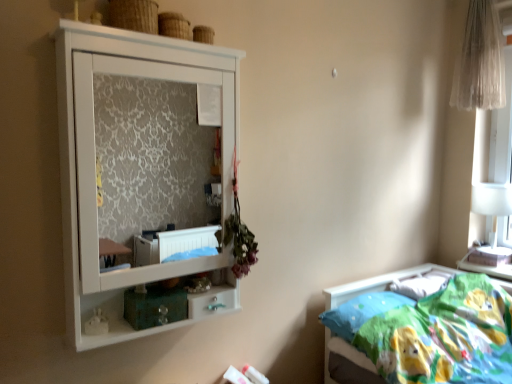
What do you see at coordinates (212, 302) in the screenshot? I see `white glossy drawer at lower center` at bounding box center [212, 302].

What do you see at coordinates (492, 202) in the screenshot? I see `white glossy table lamp at right` at bounding box center [492, 202].

This screenshot has height=384, width=512. I want to click on white glossy drawer at lower center, so click(x=212, y=302).

Does soft cotton bed at lower right appear on the right side of white matte cupboard at upper left?

Indeed, soft cotton bed at lower right is positioned on the right side of white matte cupboard at upper left.

Which object is closer to the camera taking this photo, soft cotton bed at lower right or white matte cupboard at upper left?

white matte cupboard at upper left is more forward.

Can white matte cupboard at upper left be found inside soft cotton bed at lower right?

No, soft cotton bed at lower right does not contain white matte cupboard at upper left.

Considering the relative sizes of blue fabric pillow at lower right and soft cotton bed at lower right in the image provided, is blue fabric pillow at lower right smaller than soft cotton bed at lower right?

Correct, blue fabric pillow at lower right occupies less space than soft cotton bed at lower right.

From a real-world perspective, which is physically below, blue fabric pillow at lower right or soft cotton bed at lower right?

From a 3D spatial view, soft cotton bed at lower right is below.

Measure the distance between blue fabric pillow at lower right and soft cotton bed at lower right.

blue fabric pillow at lower right is 5.09 inches from soft cotton bed at lower right.

Are blue fabric pillow at lower right and soft cotton bed at lower right making contact?

blue fabric pillow at lower right is not next to soft cotton bed at lower right, and they're not touching.

Is white glossy table lamp at right aimed at sheer white curtain at upper right?

No, white glossy table lamp at right is not oriented towards sheer white curtain at upper right.

Considering the relative positions of white glossy table lamp at right and sheer white curtain at upper right in the image provided, is white glossy table lamp at right behind sheer white curtain at upper right?

Yes, white glossy table lamp at right is further from the camera.

Based on their positions, is white glossy table lamp at right located to the left or right of sheer white curtain at upper right?

white glossy table lamp at right is to the right of sheer white curtain at upper right.

Is point (471, 203) less distant than point (475, 64)?

No, it is not.

Is the position of wooden textured basket at upper center more distant than that of white glossy drawer at lower center?

That is False.

Is wooden textured basket at upper center bigger than white glossy drawer at lower center?

Yes.

Is point (135, 4) closer or farther from the camera than point (221, 300)?

Point (135, 4) appears to be farther away from the viewer than point (221, 300).

How much distance is there between wooden textured basket at upper center and white glossy drawer at lower center?

A distance of 1.17 meters exists between wooden textured basket at upper center and white glossy drawer at lower center.

Is wooden textured basket at upper center to the right of blue fabric pillow at lower right from the viewer's perspective?

No.

Is wooden textured basket at upper center spatially inside blue fabric pillow at lower right, or outside of it?

The correct answer is: outside.

Is the depth of wooden textured basket at upper center greater than that of blue fabric pillow at lower right?

That is False.

From the image's perspective, who appears lower, wooden textured basket at upper center or blue fabric pillow at lower right?

From the image's view, blue fabric pillow at lower right is below.

From a real-world perspective, which object rests below the other?

From a 3D spatial view, blue fabric pillow at lower right is below.

Considering the sizes of objects blue fabric pillow at lower right and white matte cupboard at upper left in the image provided, who is shorter, blue fabric pillow at lower right or white matte cupboard at upper left?

With less height is blue fabric pillow at lower right.

Which of these two, blue fabric pillow at lower right or white matte cupboard at upper left, is bigger?

white matte cupboard at upper left is bigger.

Is blue fabric pillow at lower right surrounded by white glossy table lamp at right?

Actually, blue fabric pillow at lower right is outside white glossy table lamp at right.

Where is `table lamp behind the blue fabric pillow at lower right`? Image resolution: width=512 pixels, height=384 pixels. table lamp behind the blue fabric pillow at lower right is located at coordinates (492, 202).

From the image's perspective, which one is positioned lower, white glossy table lamp at right or blue fabric pillow at lower right?

blue fabric pillow at lower right appears lower in the image.

Between white glossy table lamp at right and blue fabric pillow at lower right, which one appears on the left side from the viewer's perspective?

From the viewer's perspective, blue fabric pillow at lower right appears more on the left side.

I want to click on cupboard above the soft cotton bed at lower right (from a real-world perspective), so click(x=140, y=166).

In the image, there is a blue fabric pillow at lower right. Where is `bed below it (from the image's perspective)`? bed below it (from the image's perspective) is located at coordinates (380, 283).

Based on their spatial positions, is wooden textured basket at upper center or blue fabric pillow at lower right further from sheer white curtain at upper right?

The object further to sheer white curtain at upper right is wooden textured basket at upper center.

Which object lies nearer to the anchor point white glossy table lamp at right, sheer white curtain at upper right or blue fabric pillow at lower right?

sheer white curtain at upper right lies closer to white glossy table lamp at right than the other object.

When comparing their distances from white matte cupboard at upper left, does white glossy table lamp at right or white glossy drawer at lower center seem further?

Based on the image, white glossy table lamp at right appears to be further to white matte cupboard at upper left.

Which object lies nearer to the anchor point blue fabric pillow at lower right, white glossy table lamp at right or wooden textured basket at upper center?

white glossy table lamp at right is positioned closer to the anchor blue fabric pillow at lower right.

Looking at the image, which one is located closer to white matte cupboard at upper left, blue fabric pillow at lower right or wooden textured basket at upper center?

wooden textured basket at upper center.

Estimate the real-world distances between objects in this image. Which object is closer to blue fabric pillow at lower right, white matte cupboard at upper left or soft cotton bed at lower right?

soft cotton bed at lower right is positioned closer to the anchor blue fabric pillow at lower right.

Considering their positions, is sheer white curtain at upper right positioned closer to white matte cupboard at upper left than soft cotton bed at lower right?

The object closer to white matte cupboard at upper left is soft cotton bed at lower right.

Based on their spatial positions, is sheer white curtain at upper right or white glossy table lamp at right further from blue fabric pillow at lower right?

sheer white curtain at upper right.

Locate an element on the screen. The width and height of the screenshot is (512, 384). drawer between wooden textured basket at upper center and white glossy table lamp at right is located at coordinates (212, 302).

Where is `drawer situated between wooden textured basket at upper center and sheer white curtain at upper right from left to right`? drawer situated between wooden textured basket at upper center and sheer white curtain at upper right from left to right is located at coordinates (212, 302).

In order to click on drawer located between white matte cupboard at upper left and blue fabric pillow at lower right in the left-right direction in this screenshot , I will do `click(212, 302)`.

Image resolution: width=512 pixels, height=384 pixels. What are the coordinates of `pillow between soft cotton bed at lower right and white glossy table lamp at right from front to back` in the screenshot? It's located at (361, 312).